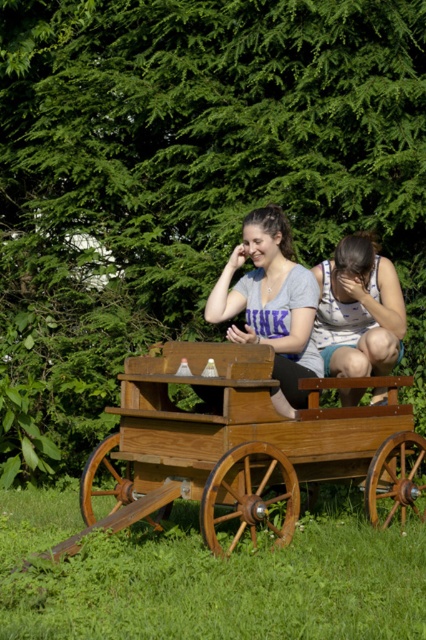
You are planning to place a small garden statue that requires a 1 square foot space. Based on the scene, which object from the listed objects can accommodate this statue without overlapping? Please choose between the green grass at lower center and the wooden wagon at center.

The wooden wagon at center can accommodate the statue since the green grass at lower center is smaller and may not provide enough space.

You are standing in front of the rustic wooden cart and want to place a small potted plant between the green grass at lower center and the matte gray shirt at center. Based on their positions, where should the potted plant be placed relative to these two objects?

The green grass at lower center is closer to the viewer than the matte gray shirt at center, so the potted plant should be placed between them, closer to the green grass at lower center to maintain the spatial relationship.

You are a photographer planning to take a photo of the matte gray shirt at center and the green grass at lower center. Which object will occupy more space in the photo?

The green grass at lower center will occupy more space in the photo because it has a larger size compared to the matte gray shirt at center.